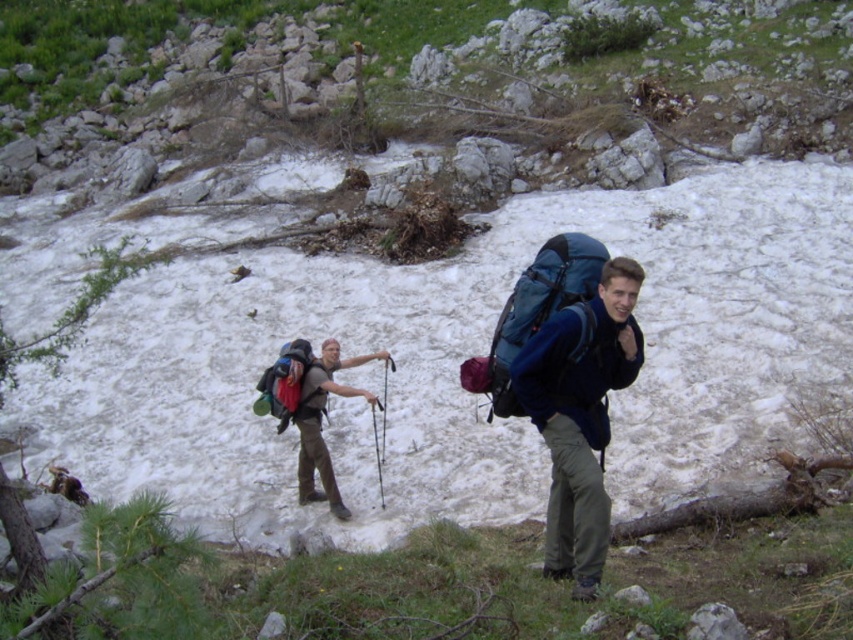
Question: Which of the following is the farthest from the observer?

Choices:
 (A) (318, 422)
 (B) (544, 259)
 (C) (292, 400)

Answer: (A)

Question: Is blue fabric backpack at right closer to the viewer compared to matte black backpack at center?

Choices:
 (A) no
 (B) yes

Answer: (B)

Question: Does teal fabric backpack at center have a smaller size compared to brushed metal backpack at center-left?

Choices:
 (A) no
 (B) yes

Answer: (B)

Question: Which object is closer to the camera taking this photo?

Choices:
 (A) teal fabric backpack at center
 (B) matte black backpack at center

Answer: (A)

Question: Which of the following is the farthest from the observer?

Choices:
 (A) blue fabric backpack at right
 (B) teal fabric backpack at center

Answer: (B)

Question: Is matte black backpack at center smaller than brushed metal backpack at center-left?

Choices:
 (A) no
 (B) yes

Answer: (A)